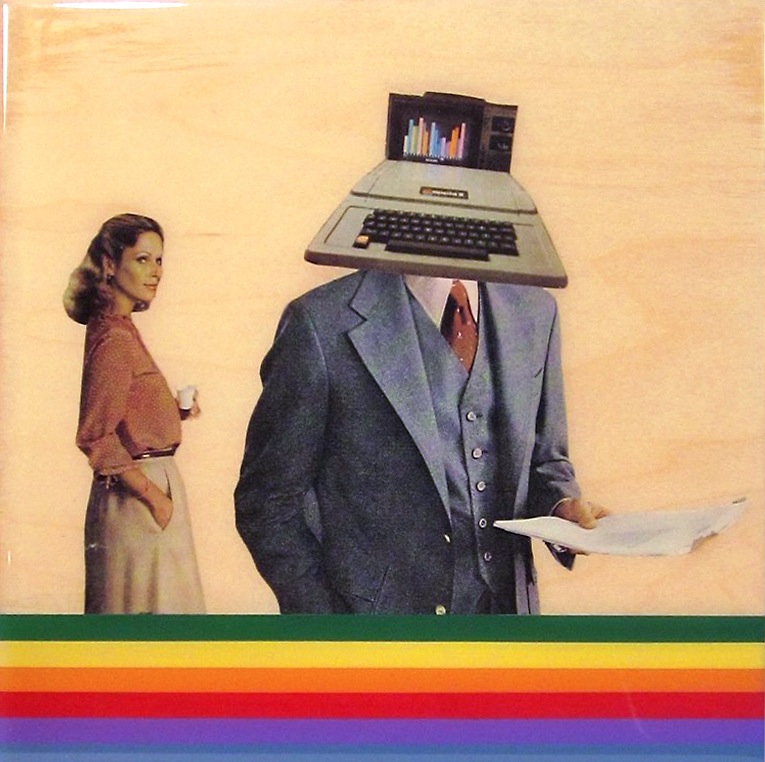
Find the location of a particular element. This screenshot has width=765, height=762. keyboard is located at coordinates (402, 191).